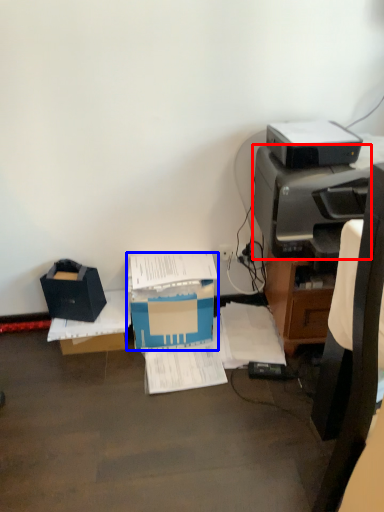
Question: Which object is closer to the camera taking this photo, printer (highlighted by a red box) or box (highlighted by a blue box)?

Choices:
 (A) printer
 (B) box

Answer: (A)